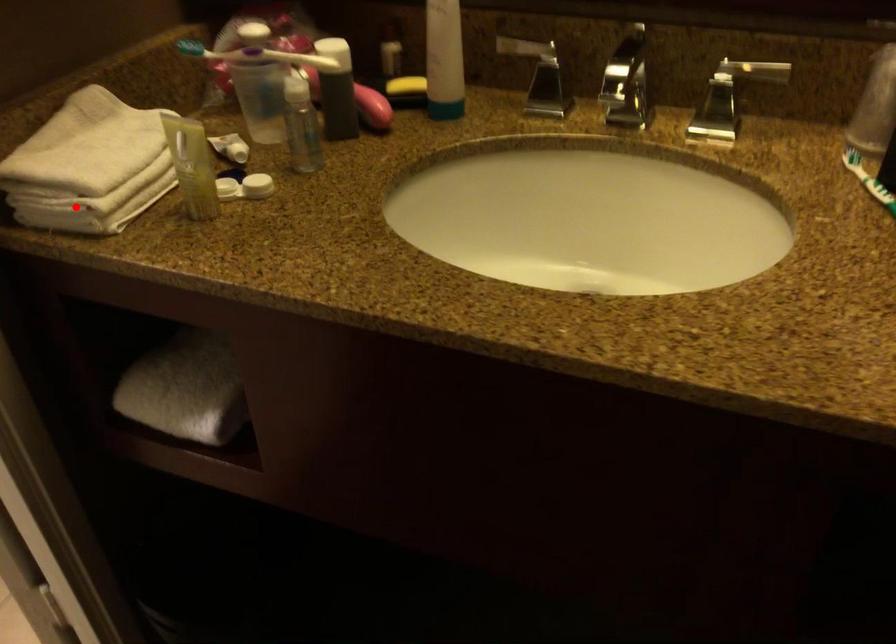
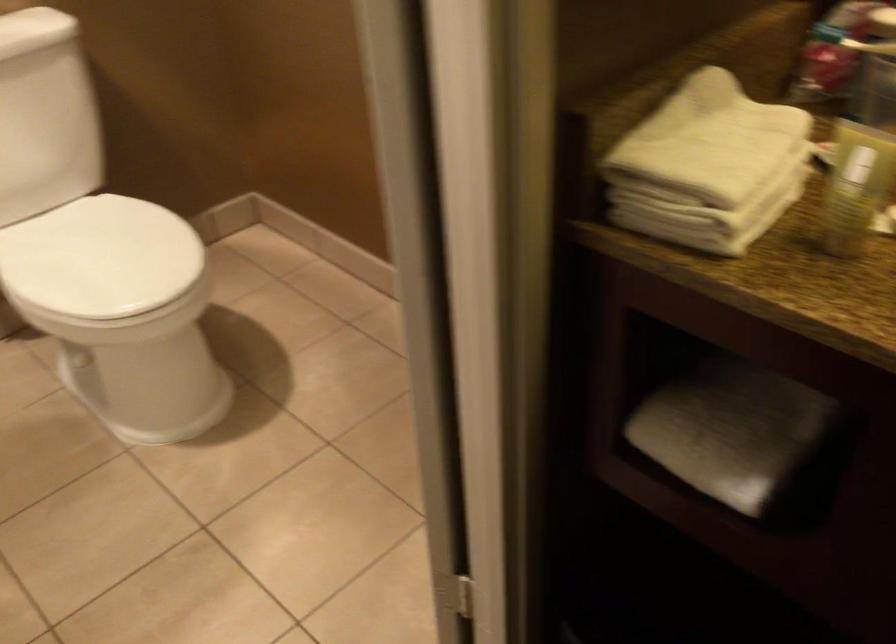
Question: I am providing you with two images of the same scene from different viewpoints. Image1 has a red point marked. In image2, the corresponding 3D location appears at what relative position? Reply with the corresponding letter.

Choices:
 (A) Closer
 (B) Farther

Answer: (A)